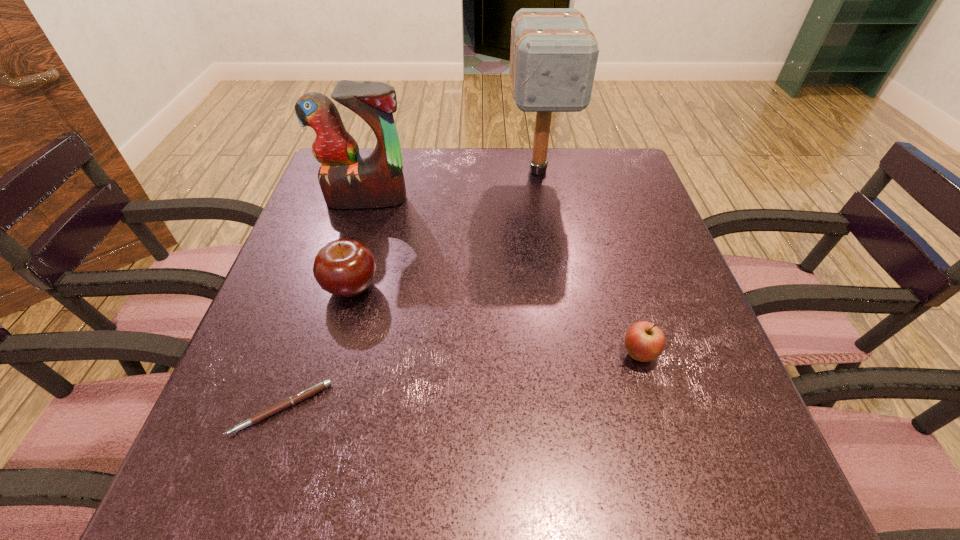
This screenshot has width=960, height=540. Identify the location of free region located 0.330m at the face of the parrot. (331, 316).

Find the location of `free space located 0.320m on the back of the farther apple`. free space located 0.320m on the back of the farther apple is located at coordinates (380, 183).

In order to click on vacant space situated 0.050m on the right of the right apple in this screenshot , I will do `click(685, 354)`.

The width and height of the screenshot is (960, 540). I want to click on free space located at the nib of the shortest object, so click(x=252, y=498).

The width and height of the screenshot is (960, 540). I want to click on mallet that is at the far edge, so click(553, 56).

Image resolution: width=960 pixels, height=540 pixels. What are the coordinates of `parrot situated at the far edge` in the screenshot? It's located at (347, 181).

Image resolution: width=960 pixels, height=540 pixels. Identify the location of parrot at the left edge. (347, 181).

Find the location of a particular element. apple that is at the left edge is located at coordinates (344, 267).

The height and width of the screenshot is (540, 960). What are the coordinates of `pen present at the left edge` in the screenshot? It's located at (292, 400).

Find the location of a particular element. object situated at the right edge is located at coordinates (644, 341).